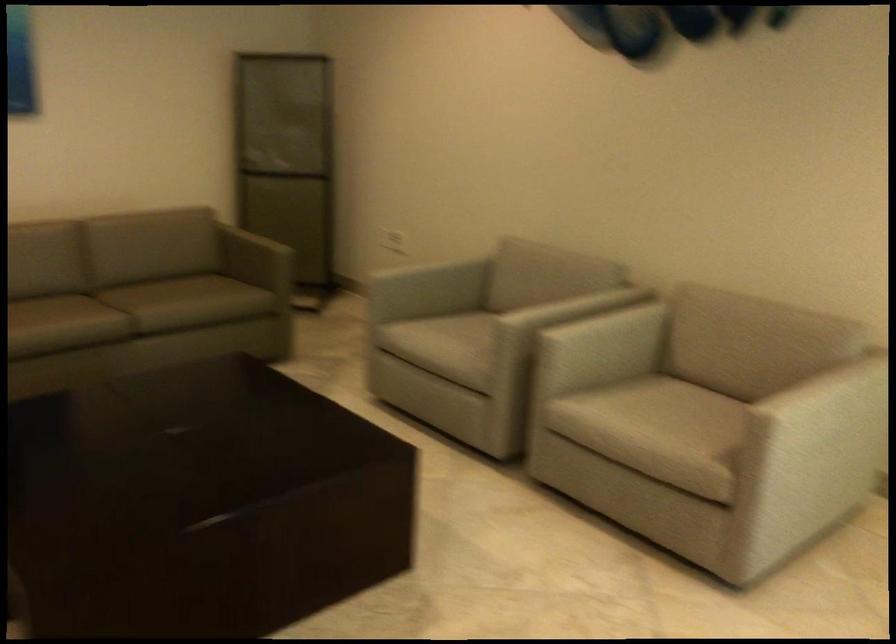
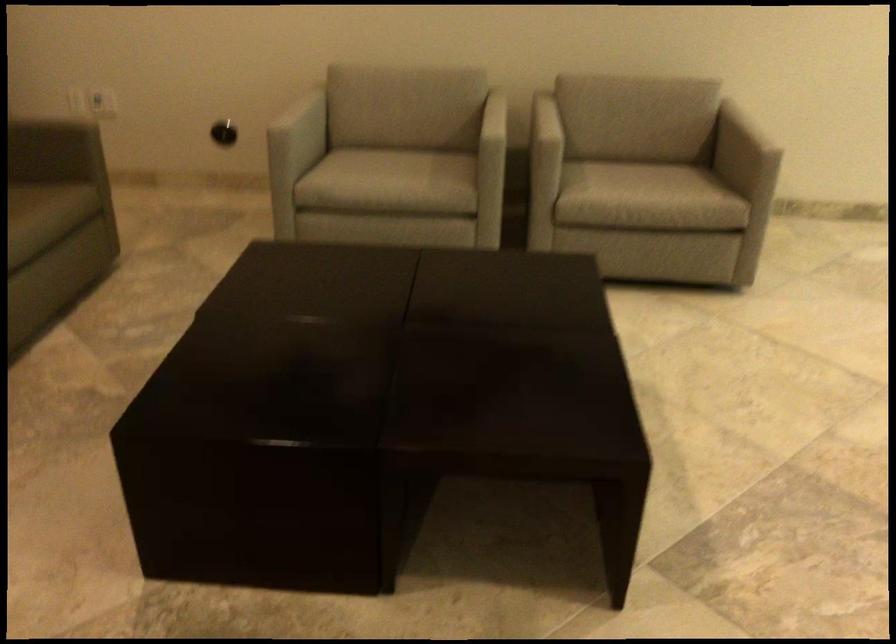
In the second image, find the point that corresponds to point (450, 283) in the first image.

(304, 124)